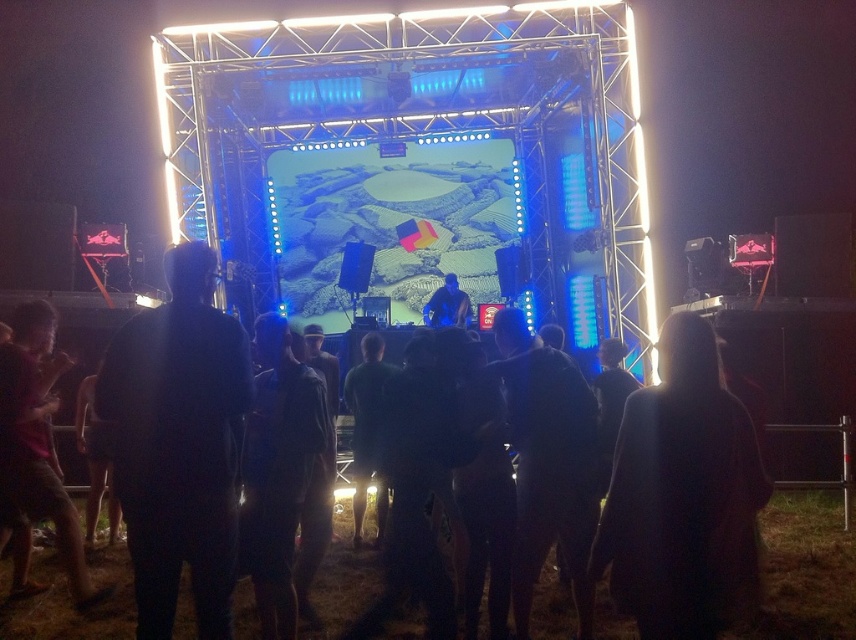
You are standing in front of the stage at the music festival. You notice two points marked on the ground. One is at coordinates point (x=667, y=339) and the other is at point (x=15, y=372). Which point is closer to you?

Point (x=667, y=339) is closer to the viewer than point (x=15, y=372).

A drone is flying at point (744, 419) and needs to deliver a package to the stage. The drone can only travel 40 feet before needing to recharge. Will it be able to reach the stage without recharging?

The distance between the drone at point (744, 419) and the stage is 43.17 feet. Since the drone can only travel 40 feet before recharging, it will not be able to reach the stage without recharging.